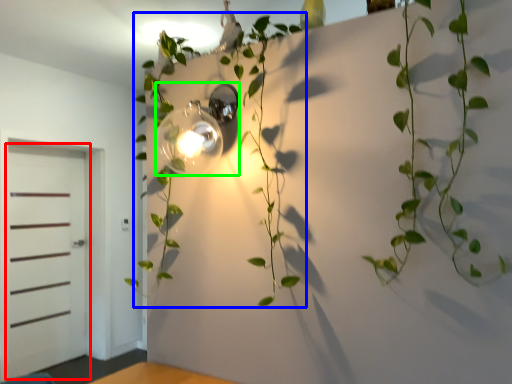
Question: Which is nearer to the door (highlighted by a red box)? plant (highlighted by a blue box) or light fixture (highlighted by a green box).

Choices:
 (A) plant
 (B) light fixture

Answer: (A)